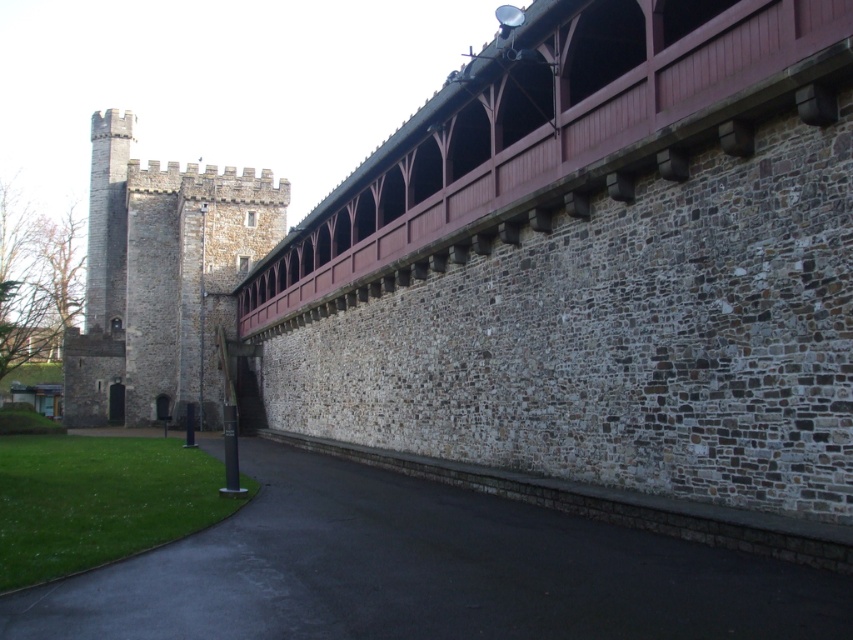
Can you confirm if black asphalt path at lower center is shorter than gray stone tower at left?

Indeed, black asphalt path at lower center has a lesser height compared to gray stone tower at left.

Can you confirm if black asphalt path at lower center is positioned to the right of gray stone tower at left?

Correct, you'll find black asphalt path at lower center to the right of gray stone tower at left.

Who is more forward, (144, 566) or (103, 333)?

Point (144, 566)

Locate an element on the screen. black asphalt path at lower center is located at coordinates (425, 572).

Which is more to the right, wooden planks at upper center or gray stone tower at left?

From the viewer's perspective, wooden planks at upper center appears more on the right side.

Is point (430, 177) closer to viewer compared to point (131, 141)?

Yes, it is in front of point (131, 141).

Where is `wooden planks at upper center`? wooden planks at upper center is located at coordinates (554, 132).

Which is behind, point (252, 525) or point (312, 240)?

The point (312, 240) is more distant.

In the scene shown: Does black asphalt path at lower center have a greater height compared to wooden planks at upper center?

No, black asphalt path at lower center is not taller than wooden planks at upper center.

Who is more distant from viewer, (517, 550) or (682, 147)?

The point (682, 147) is behind.

Image resolution: width=853 pixels, height=640 pixels. I want to click on black asphalt path at lower center, so click(x=425, y=572).